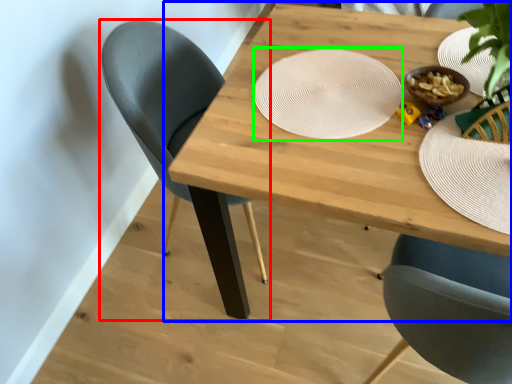
Question: Which object is positioned closest to chair (highlighted by a red box)? Select from table (highlighted by a blue box) and platter (highlighted by a green box).

Choices:
 (A) table
 (B) platter

Answer: (A)